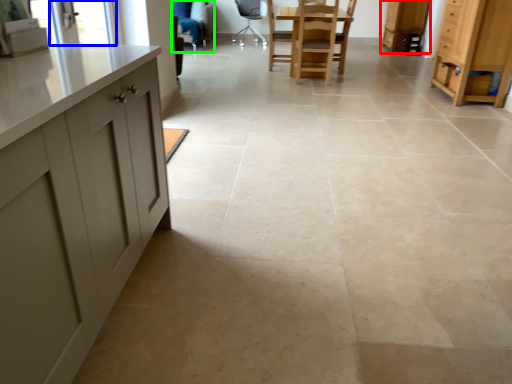
Question: Considering the real-world distances, which object is closest to cabinetry (highlighted by a red box)? window screen (highlighted by a blue box) or armchair (highlighted by a green box).

Choices:
 (A) window screen
 (B) armchair

Answer: (B)